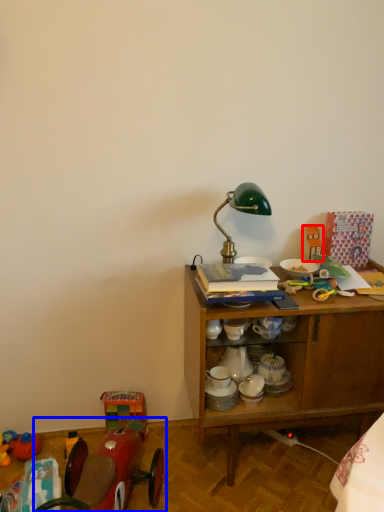
Question: Which object is further to the camera taking this photo, toy (highlighted by a red box) or toy (highlighted by a blue box)?

Choices:
 (A) toy
 (B) toy

Answer: (A)